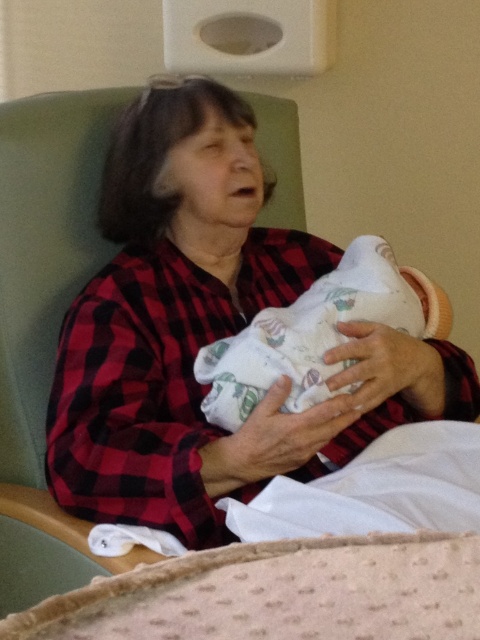
From the picture: Is red plaid shirt at center positioned in front of white soft swaddle at center?

Yes, red plaid shirt at center is in front of white soft swaddle at center.

Who is positioned more to the right, red plaid shirt at center or white soft swaddle at center?

white soft swaddle at center

Where is `red plaid shirt at center`? This screenshot has width=480, height=640. red plaid shirt at center is located at coordinates (208, 332).

The height and width of the screenshot is (640, 480). In order to click on red plaid shirt at center in this screenshot , I will do `click(208, 332)`.